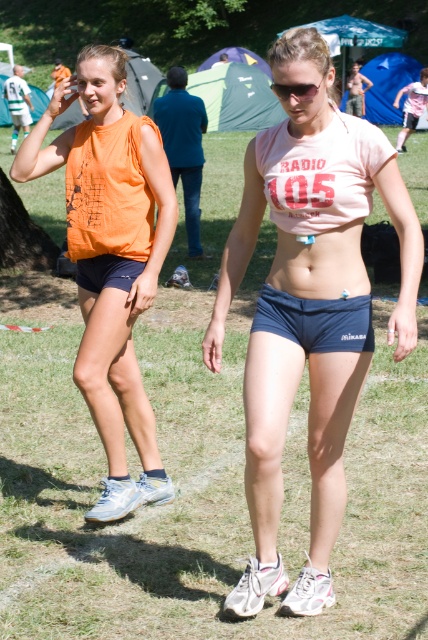
Which is more to the left, navy blue shorts at center or sunglasses at center?

sunglasses at center is more to the left.

Does navy blue shorts at center have a lesser width compared to sunglasses at center?

Incorrect, navy blue shorts at center's width is not less than sunglasses at center's.

Which is in front, point (339, 337) or point (279, 93)?

Point (279, 93) is in front.

The height and width of the screenshot is (640, 428). Identify the location of navy blue shorts at center. (315, 321).

Does matte pink t-shirt at center appear over blue fabric shorts at lower left?

Incorrect, matte pink t-shirt at center is not positioned above blue fabric shorts at lower left.

How far apart are matte pink t-shirt at center and blue fabric shorts at lower left?

The distance of matte pink t-shirt at center from blue fabric shorts at lower left is 1.31 meters.

Does point (225, 314) lie in front of point (118, 260)?

That is True.

In order to click on matte pink t-shirt at center in this screenshot , I will do `click(309, 308)`.

Does blue fabric shorts at lower left have a larger size compared to sunglasses at center?

No.

Who is shorter, blue fabric shorts at lower left or sunglasses at center?

blue fabric shorts at lower left is shorter.

The image size is (428, 640). I want to click on blue fabric shorts at lower left, so click(x=107, y=272).